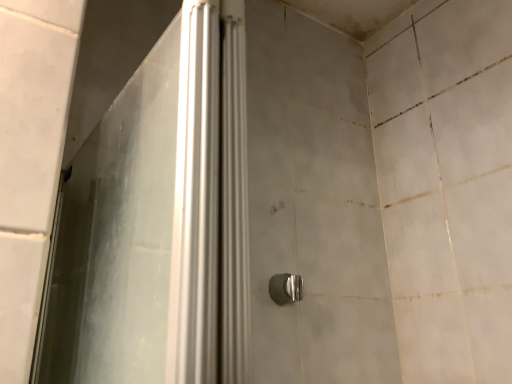
Describe the element at coordinates (285, 288) in the screenshot. I see `polished metallic door handle at center` at that location.

At what (x,y) coordinates should I click in order to perform the action: click on polished metallic door handle at center. Please return your answer as a coordinate pair (x, y). The image size is (512, 384). Looking at the image, I should click on (285, 288).

Identify the location of polished metallic door handle at center. The width and height of the screenshot is (512, 384). (285, 288).